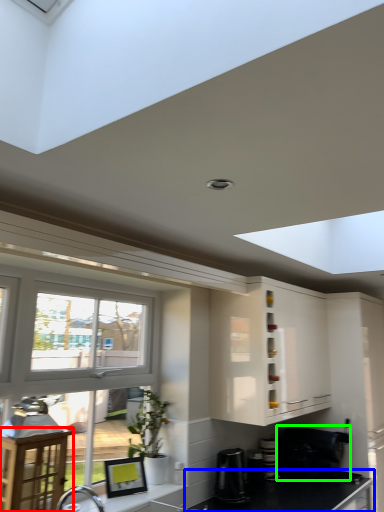
Question: Which object is positioned closest to table (highlighted by a red box)? Select from countertop (highlighted by a blue box) and appliance (highlighted by a green box).

Choices:
 (A) countertop
 (B) appliance

Answer: (A)